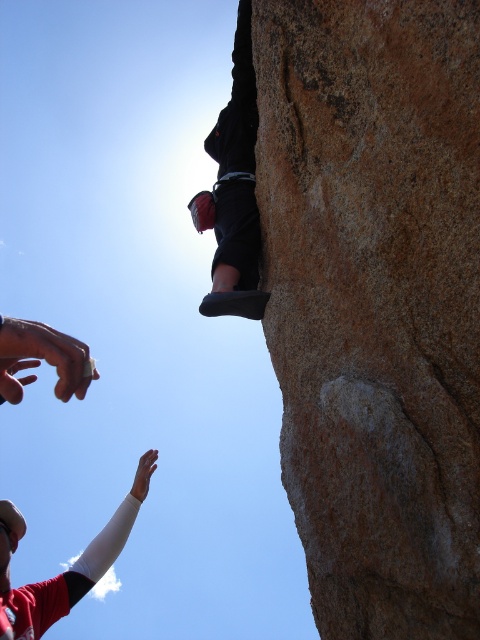
Question: Which of the following is the farthest from the observer?

Choices:
 (A) (245, 20)
 (B) (311, 598)

Answer: (A)

Question: Among these points, which one is nearest to the camera?

Choices:
 (A) (250, 188)
 (B) (467, 8)

Answer: (B)

Question: Which of the following is the closest to the observer?

Choices:
 (A) (216, 259)
 (B) (346, 104)

Answer: (B)

Question: Can you confirm if brown rough rock at upper right is thinner than black fabric climbing harness at upper center?

Choices:
 (A) no
 (B) yes

Answer: (A)

Question: Is brown rough rock at upper right thinner than black fabric climbing harness at upper center?

Choices:
 (A) yes
 (B) no

Answer: (B)

Question: Can you confirm if brown rough rock at upper right is smaller than black fabric climbing harness at upper center?

Choices:
 (A) yes
 (B) no

Answer: (A)